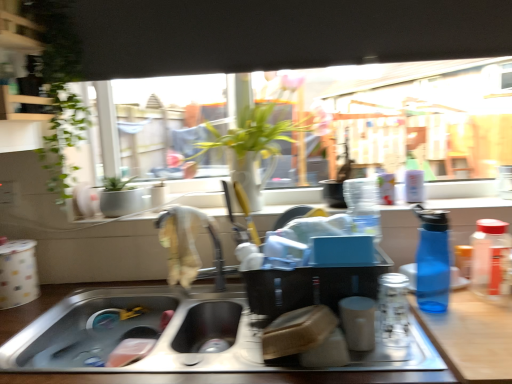
Where is `free space above green leafy plant at center (from a real-world perspective)`? free space above green leafy plant at center (from a real-world perspective) is located at coordinates (253, 72).